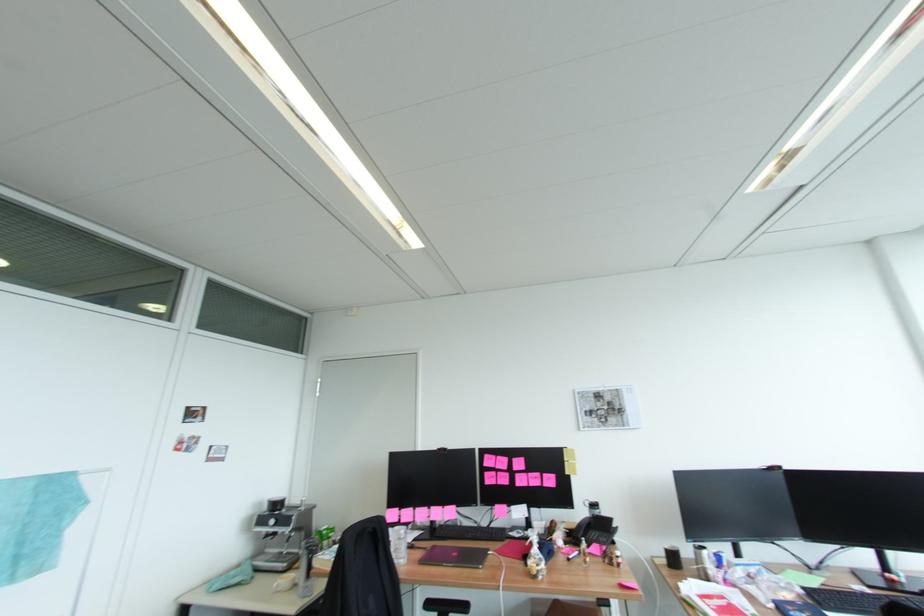
Find where to lift the black telephone handset. Please return your answer as a coordinate pair (x, y).

(597, 541)